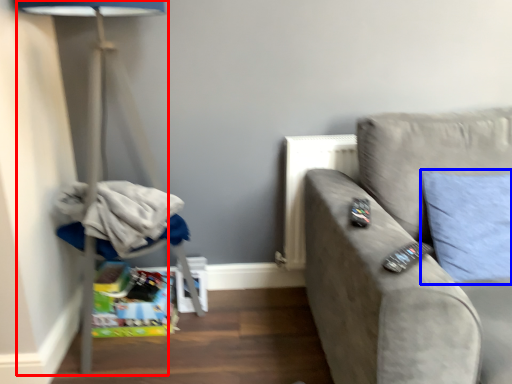
Question: Which of the following is the closest to the observer, table lamp (highlighted by a red box) or pillow (highlighted by a blue box)?

Choices:
 (A) table lamp
 (B) pillow

Answer: (A)